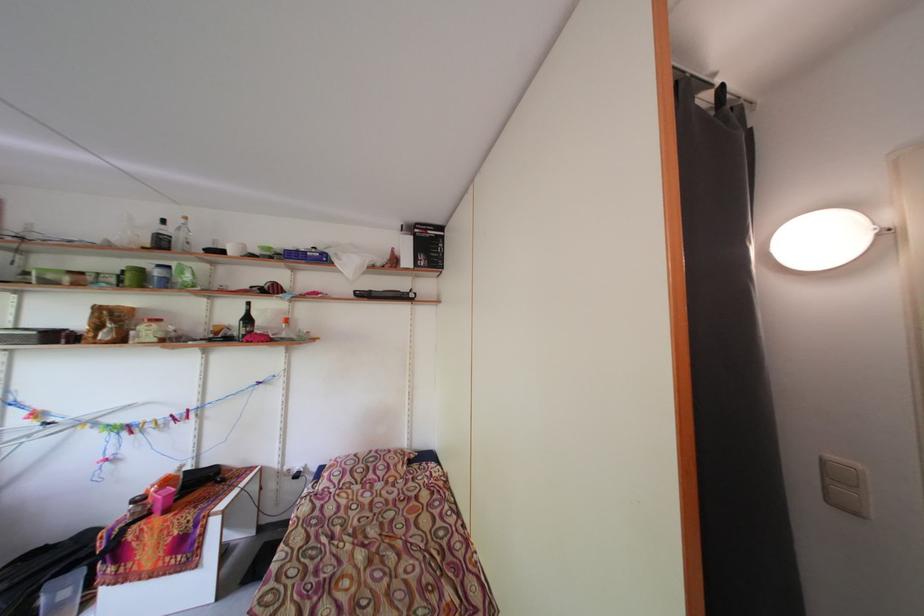
Where would you pour the black liquor bottle? Please return your answer as a coordinate pair (x, y).

(246, 322)